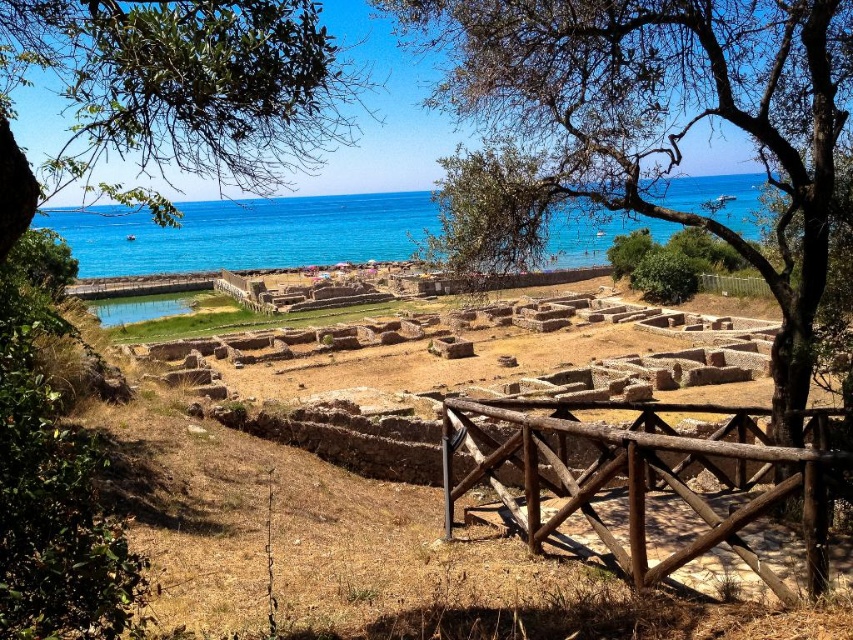
Is green leafy tree at center wider than blue water at upper center?

In fact, green leafy tree at center might be narrower than blue water at upper center.

Is green leafy tree at center to the right of blue water at upper center from the viewer's perspective?

Indeed, green leafy tree at center is positioned on the right side of blue water at upper center.

Does point (740, 52) come behind point (163, 260)?

No, (740, 52) is closer to viewer.

Find the location of a particular element. This screenshot has width=853, height=640. green leafy tree at center is located at coordinates (666, 115).

Which is below, green leafy tree at upper left or blue water at upper center?

blue water at upper center is lower down.

Is green leafy tree at upper left positioned in front of blue water at upper center?

Yes, green leafy tree at upper left is closer to the viewer.

Does point (148, 28) come in front of point (375, 232)?

Yes.

At what (x,y) coordinates should I click in order to perform the action: click on green leafy tree at upper left. Please return your answer as a coordinate pair (x, y). The height and width of the screenshot is (640, 853). Looking at the image, I should click on (173, 90).

What do you see at coordinates (248, 234) in the screenshot? I see `blue water at upper center` at bounding box center [248, 234].

Between blue water at upper center and wooden fence at center-right, which one is positioned lower?

Positioned lower is wooden fence at center-right.

Who is more distant from viewer, (262, 208) or (741, 289)?

Point (262, 208)

The width and height of the screenshot is (853, 640). What are the coordinates of `blue water at upper center` in the screenshot? It's located at (248, 234).